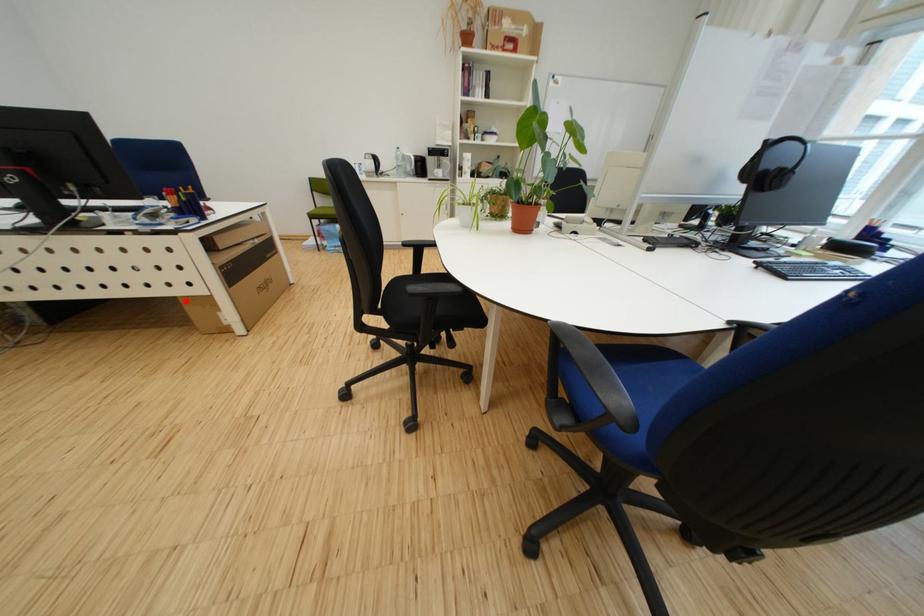
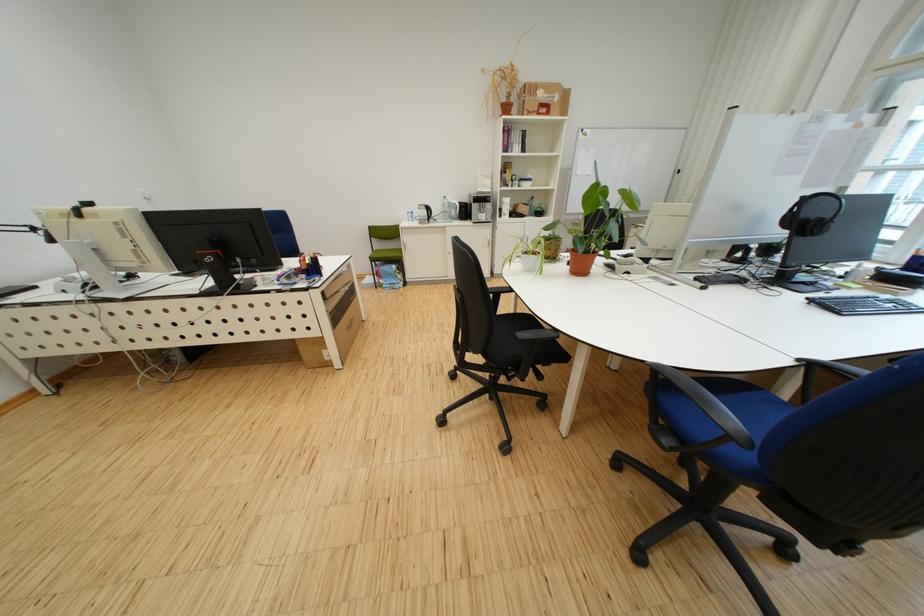
The point at the highlighted location is marked in the first image. Where is the corresponding point in the second image?

(306, 342)